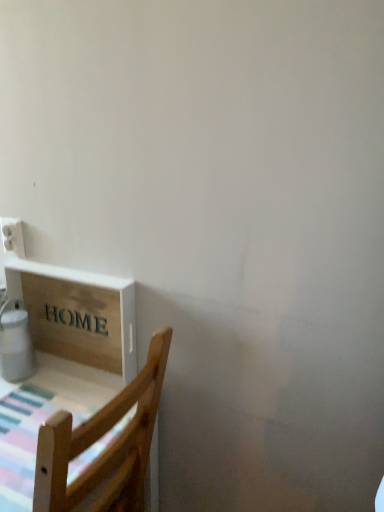
Question: In terms of height, does white glossy water heater at lower left look taller or shorter compared to wooden sign at lower left?

Choices:
 (A) tall
 (B) short

Answer: (B)

Question: Considering their positions, is white glossy water heater at lower left located in front of or behind wooden sign at lower left?

Choices:
 (A) behind
 (B) front

Answer: (A)

Question: Estimate the real-world distances between objects in this image. Which object is farther from the wooden chair at lower left?

Choices:
 (A) wooden sign at lower left
 (B) white plastic electric outlet at upper left
 (C) white glossy water heater at lower left

Answer: (B)

Question: Estimate the real-world distances between objects in this image. Which object is farther from the wooden sign at lower left?

Choices:
 (A) white glossy water heater at lower left
 (B) white plastic electric outlet at upper left
 (C) wooden chair at lower left

Answer: (C)